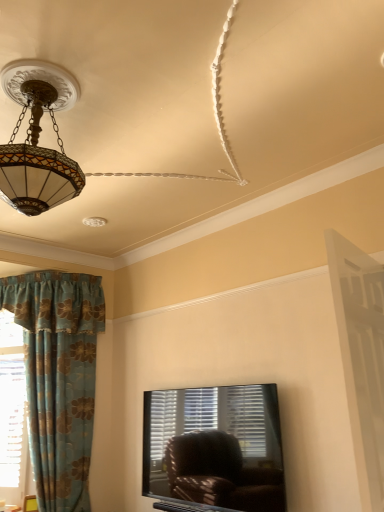
Question: From the image's perspective, would you say blue floral fabric curtain at left is positioned over white wooden screen door at right?

Choices:
 (A) yes
 (B) no

Answer: (B)

Question: Is blue floral fabric curtain at left not near white wooden screen door at right?

Choices:
 (A) yes
 (B) no

Answer: (A)

Question: Is blue floral fabric curtain at left shorter than white wooden screen door at right?

Choices:
 (A) yes
 (B) no

Answer: (B)

Question: Is blue floral fabric curtain at left facing away from white wooden screen door at right?

Choices:
 (A) yes
 (B) no

Answer: (B)

Question: Is white wooden screen door at right surrounded by blue floral fabric curtain at left?

Choices:
 (A) yes
 (B) no

Answer: (B)

Question: Considering the relative positions of blue floral fabric curtain at left and white wooden screen door at right in the image provided, is blue floral fabric curtain at left to the left of white wooden screen door at right from the viewer's perspective?

Choices:
 (A) yes
 (B) no

Answer: (A)

Question: From the image's perspective, is blue floral fabric curtain at left located beneath matte glass chandelier at upper left?

Choices:
 (A) yes
 (B) no

Answer: (A)

Question: Is blue floral fabric curtain at left bigger than matte glass chandelier at upper left?

Choices:
 (A) yes
 (B) no

Answer: (A)

Question: Does blue floral fabric curtain at left appear on the right side of matte glass chandelier at upper left?

Choices:
 (A) yes
 (B) no

Answer: (B)

Question: Is blue floral fabric curtain at left oriented towards matte glass chandelier at upper left?

Choices:
 (A) no
 (B) yes

Answer: (B)

Question: Can you confirm if blue floral fabric curtain at left is taller than matte glass chandelier at upper left?

Choices:
 (A) no
 (B) yes

Answer: (B)

Question: Is blue floral fabric curtain at left not close to matte glass chandelier at upper left?

Choices:
 (A) no
 (B) yes

Answer: (B)

Question: Considering the relative sizes of white wooden screen door at right and tiffany glass pendant light at upper left in the image provided, is white wooden screen door at right wider than tiffany glass pendant light at upper left?

Choices:
 (A) yes
 (B) no

Answer: (B)